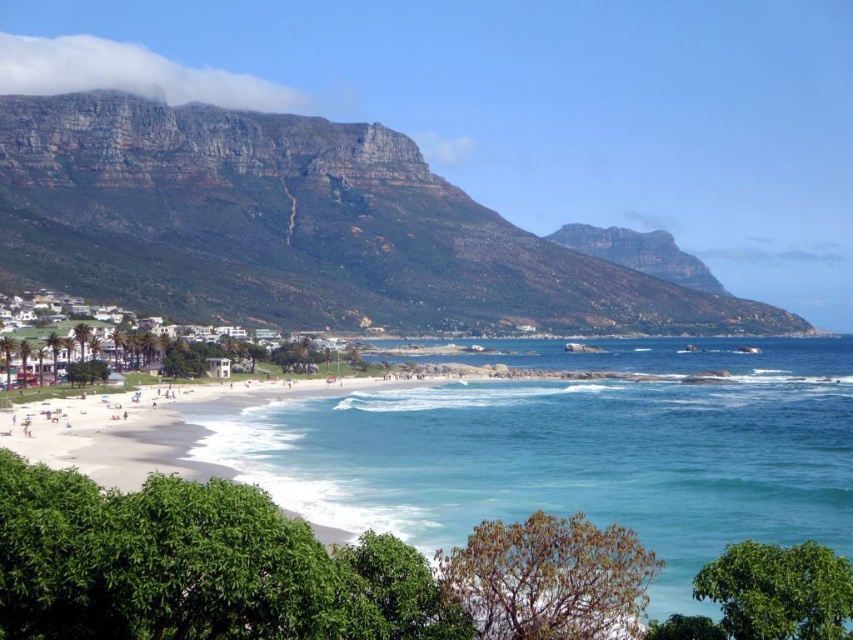
You are a hiker standing at the base of the rugged rock mountain at upper center and want to reach the clear blue water at center. Which direction should you head towards?

The rugged rock mountain at upper center is positioned on the left side of clear blue water at center, so you should head towards the right to reach the clear blue water at center.

You are a hiker planning to take a photo of the rugged rock mountain at upper center and the clear blue water at center. Which object should you focus on first if you want to capture both in a single frame without moving the camera?

You should focus on the rugged rock mountain at upper center first because it is larger in size than the clear blue water at center, so it will occupy more space in the frame and ensure proper composition.

From the picture: You are standing at the beach looking towards the ocean. There are two points marked on the image. The first point is at coordinates point (x=289, y=301) and the second point is at point (x=637, y=348). Which of these points is closer to you?

Point (x=289, y=301) is closer to the camera than point (x=637, y=348), so the first point is closer to you.